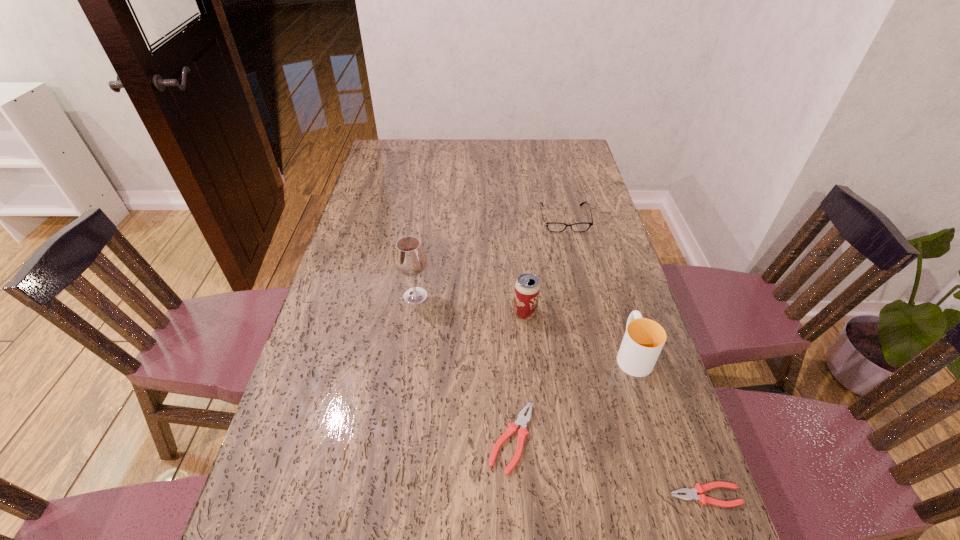
Find the location of a particular element. The image size is (960, 540). spectacles located at the right edge is located at coordinates click(x=551, y=226).

What are the coordinates of `cup at the right edge` in the screenshot? It's located at (644, 339).

Identify the location of object present at the near right corner. (691, 494).

The width and height of the screenshot is (960, 540). I want to click on free space at the far edge of the desktop, so click(x=508, y=150).

This screenshot has width=960, height=540. In order to click on vacant space at the near edge of the desktop in this screenshot , I will do `click(377, 495)`.

The image size is (960, 540). I want to click on vacant region at the left edge of the desktop, so click(x=380, y=269).

Identify the location of vacant space at the right edge of the desktop. (573, 258).

Locate an element on the screen. This screenshot has height=540, width=960. free point at the far left corner is located at coordinates (382, 153).

The image size is (960, 540). What are the coordinates of `free spot between the third shortest object and the beer can` in the screenshot? It's located at (544, 266).

The image size is (960, 540). I want to click on empty space between the cup and the second nearest object, so click(572, 396).